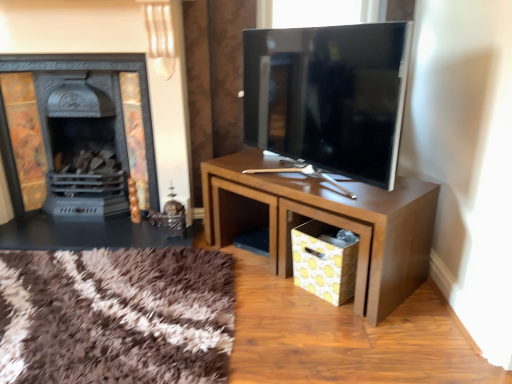
Locate an element on the screen. vacant area situated below matte black tv at center (from a real-world perspective) is located at coordinates click(x=288, y=177).